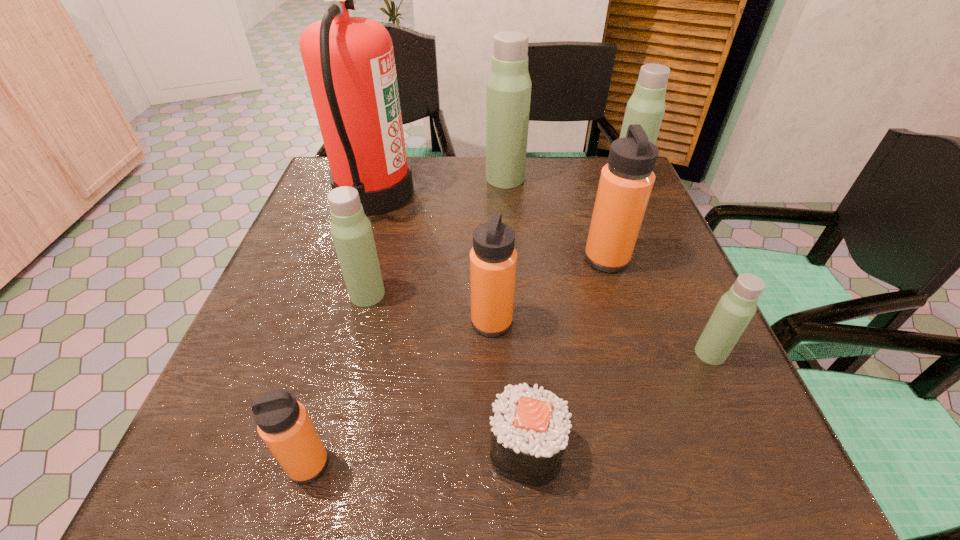
Find the location of a particular element. vacant area situated 0.380m on the right of the second biggest orange thermos bottle is located at coordinates (711, 322).

Locate an element on the screen. The width and height of the screenshot is (960, 540). free spot located 0.060m on the right of the leftmost light thermos bottle is located at coordinates (415, 294).

This screenshot has height=540, width=960. What are the coordinates of `vacant space located 0.280m on the back of the second nearest thermos bottle` in the screenshot? It's located at click(660, 244).

This screenshot has width=960, height=540. I want to click on vacant position located on the right of the leftmost orange thermos bottle, so click(423, 464).

The width and height of the screenshot is (960, 540). Identify the location of free space located 0.240m on the left of the shortest object. (328, 449).

Locate an element on the screen. This screenshot has width=960, height=540. fire extinguisher that is at the far edge is located at coordinates (349, 62).

Image resolution: width=960 pixels, height=540 pixels. I want to click on thermos bottle located in the near edge section of the desktop, so click(282, 422).

Locate an element on the screen. sushi that is at the near edge is located at coordinates (530, 427).

Image resolution: width=960 pixels, height=540 pixels. Find the location of `fire extinguisher at the left edge`. fire extinguisher at the left edge is located at coordinates (349, 62).

Identify the location of thermos bottle present at the left edge. (282, 422).